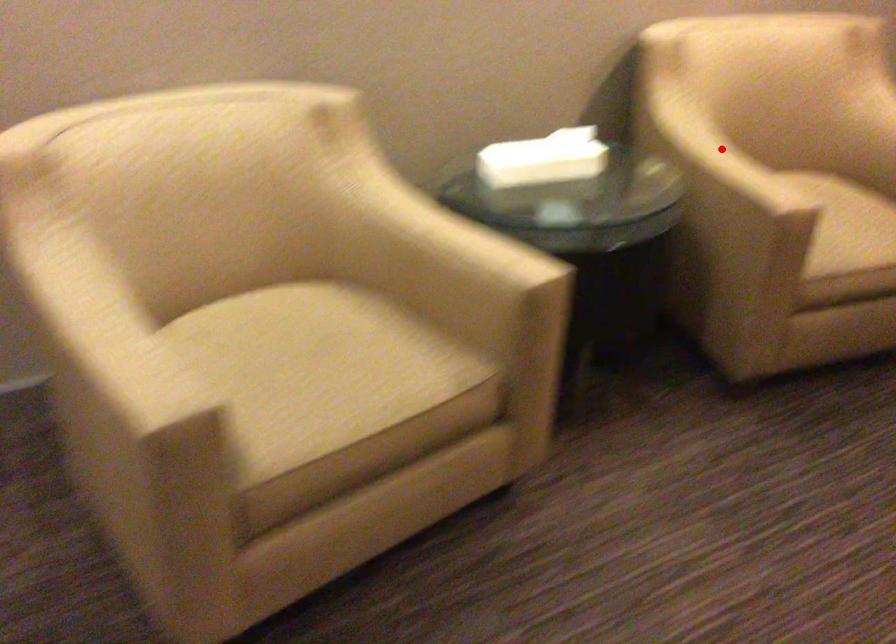
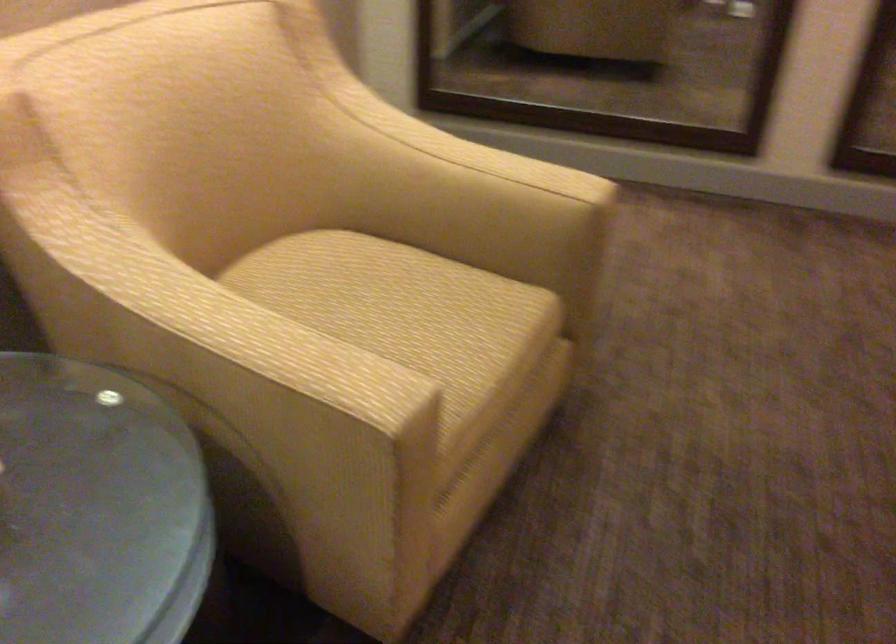
The point at the highlighted location is marked in the first image. Where is the corresponding point in the second image?

(214, 313)